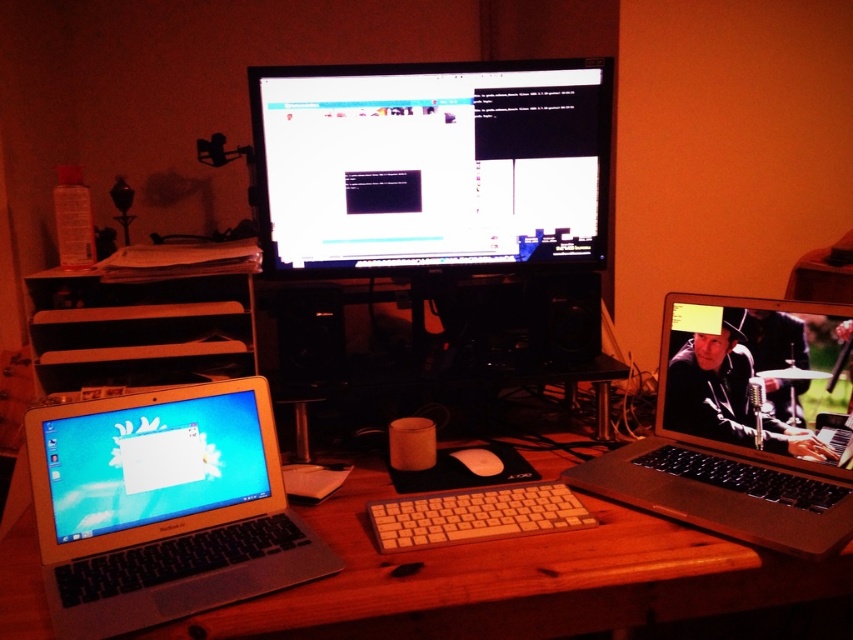
You are organizing cables on a desk and need to connect a USB cable to the silver metallic laptop at lower left and the white plastic keyboard at center. Based on their positions, which device should you plug the USB cable into first?

The silver metallic laptop at lower left is above the white plastic keyboard at center, so you should plug the USB cable into the silver metallic laptop at lower left first to reach the keyboard below it.

You are organizing your desk and want to place the white plastic keyboard at center on top of the silver metallic laptop at lower left. Is this possible based on their sizes?

The silver metallic laptop at lower left is larger in size than the white plastic keyboard at center, so yes, the white plastic keyboard at center can be placed on top of the silver metallic laptop at lower left since it is smaller in size.

In the scene shown: You are organizing items on the wooden desk at center and need to place the white matte mouse at center. Can you fit the mouse on the desk without overlapping any other objects?

The wooden desk at center is bigger than the white matte mouse at center, so yes, the mouse can be placed on the desk without overlapping other objects.